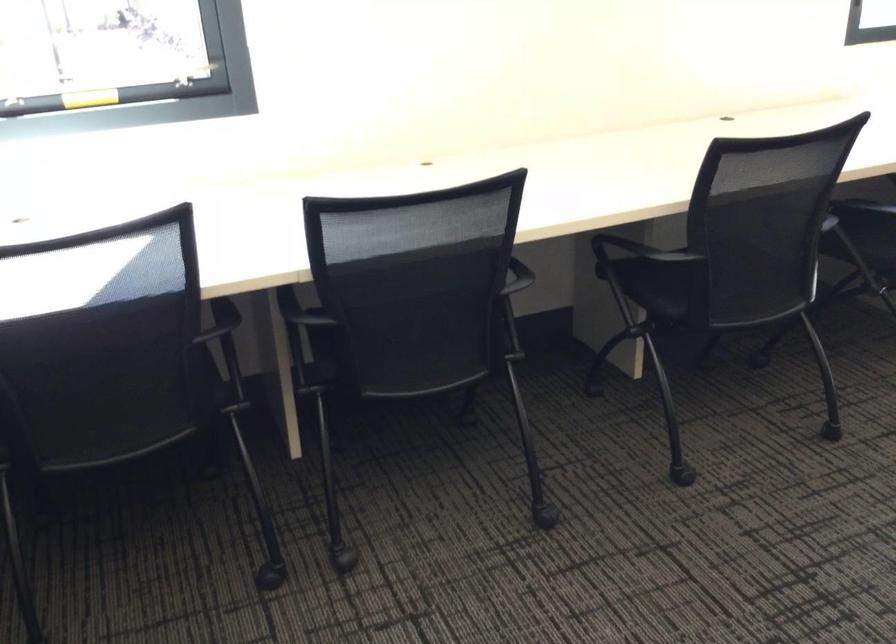
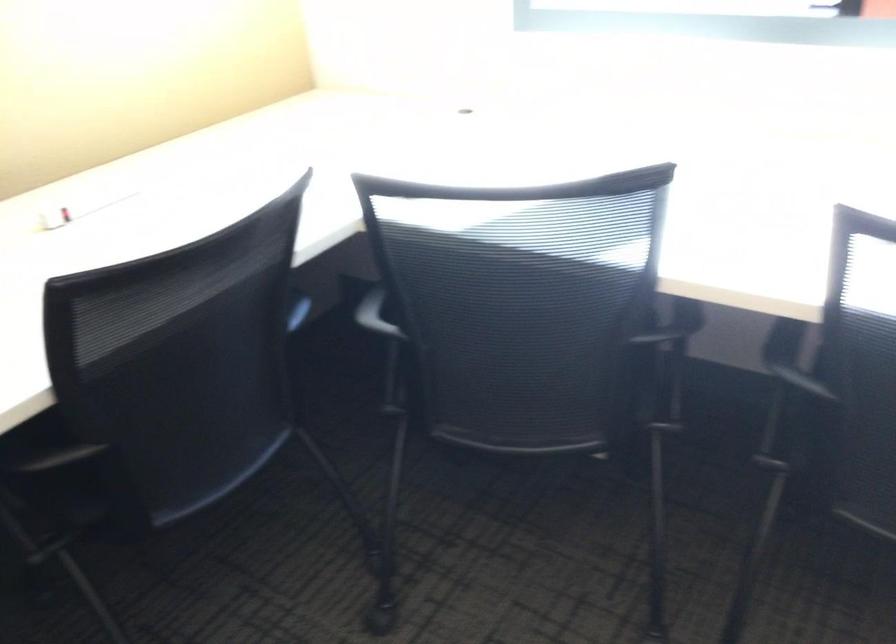
The images are taken continuously from a first-person perspective. In which direction is your viewpoint rotating?

The camera rotated toward left-down.